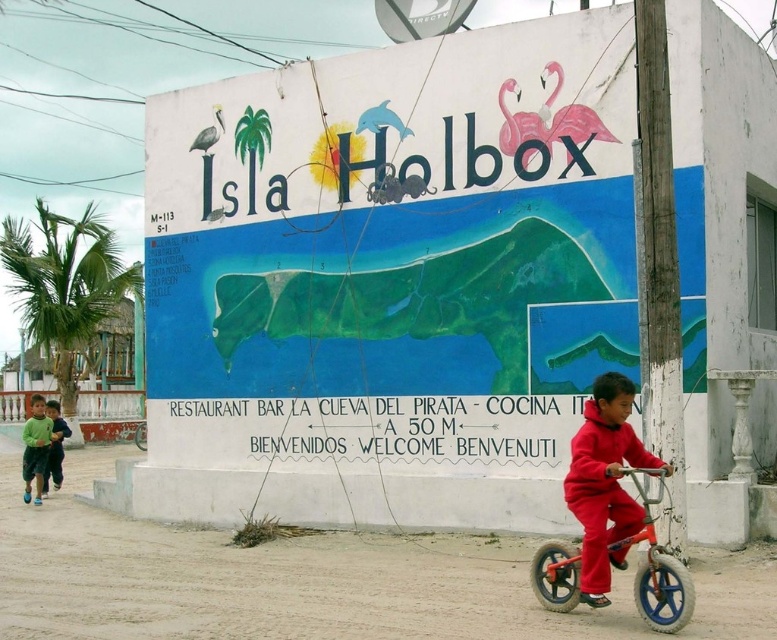
Who is more distant from viewer, (56,416) or (140,444)?

The point (140,444) is more distant.

Can you confirm if green cotton shirt at left is positioned to the right of orange matte bicycle at lower left?

Correct, you'll find green cotton shirt at left to the right of orange matte bicycle at lower left.

I want to click on green cotton shirt at left, so click(x=54, y=445).

In the scene shown: Who is more forward, [582,486] or [145,442]?

Point [582,486] is in front.

Is red fleece suit at lower right thinner than orange matte bicycle at lower left?

No.

Between point (603, 596) and point (145, 422), which one is positioned in front?

Point (603, 596) is in front.

You are a GUI agent. You are given a task and a screenshot of the screen. Output one action in this format:
    pyautogui.click(x=<x>, y=<y>)
    Task: Click on the red fleece suit at lower right
    
    Given the screenshot: What is the action you would take?
    pyautogui.click(x=605, y=483)

Is white painted sign at center smaller than green fleece jacket at lower left?

No, white painted sign at center is not smaller than green fleece jacket at lower left.

Does white painted sign at center have a greater height compared to green fleece jacket at lower left?

Correct, white painted sign at center is much taller as green fleece jacket at lower left.

Does point (194, 196) come farther from viewer compared to point (23, 436)?

No, it is in front of (23, 436).

The height and width of the screenshot is (640, 777). I want to click on white painted sign at center, so click(392, 250).